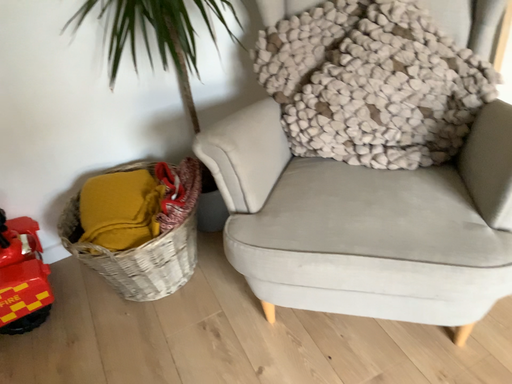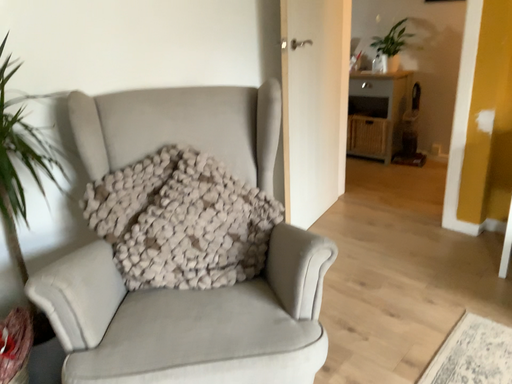
Question: Which way did the camera rotate in the video?

Choices:
 (A) rotated upward
 (B) rotated downward

Answer: (A)